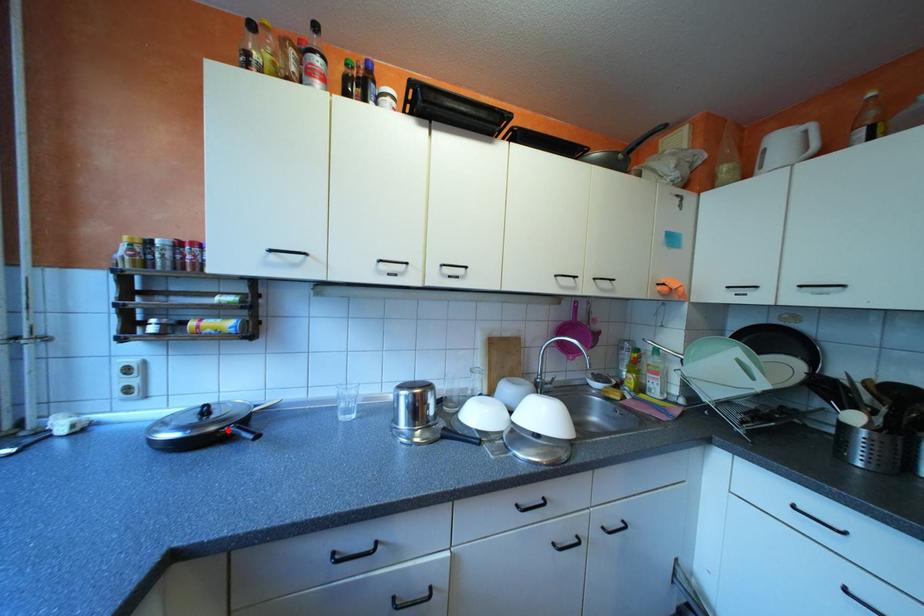
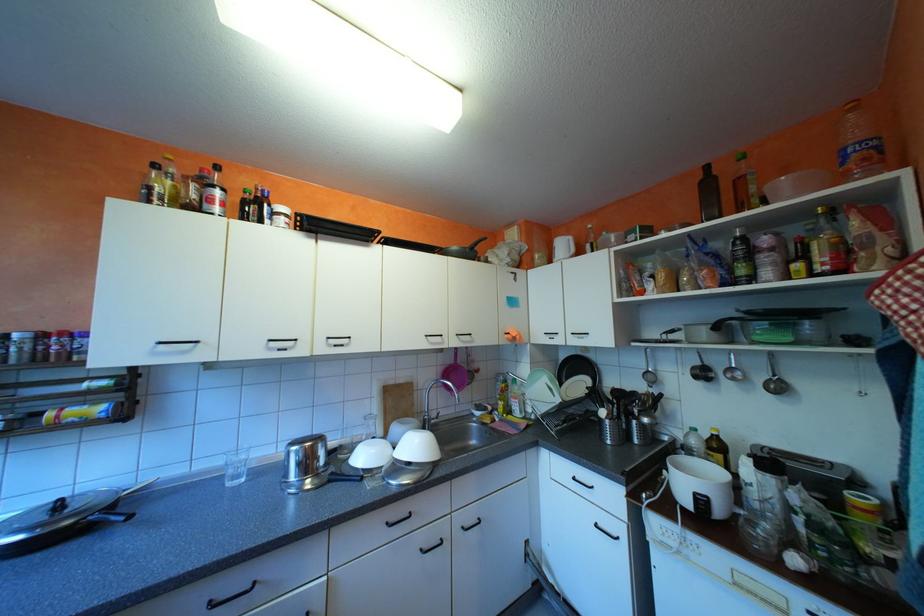
Where in the second image is the point corresponding to the highlighted location from the first image?

(88, 522)